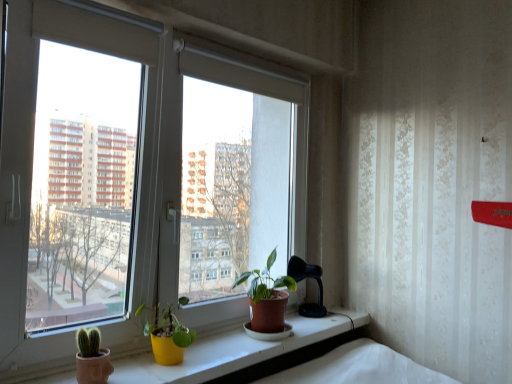
Question: From the image's perspective, is yellow matte pot at lower center, the second houseplant in the right-to-left sequence, positioned above or below matte yellow pot at center?

Choices:
 (A) above
 (B) below

Answer: (A)

Question: In terms of width, does yellow matte pot at lower center, the first houseplant in the front-to-back sequence, look wider or thinner when compared to matte yellow pot at center?

Choices:
 (A) wide
 (B) thin

Answer: (B)

Question: Based on their relative distances, which object is farther from the yellow matte pot at lower center, the 1th houseplant when ordered from left to right?

Choices:
 (A) matte yellow pot at center
 (B) matte brown pot at center, the second houseplant positioned from the front
 (C) white plastic window at center

Answer: (C)

Question: Considering the real-world distances, which object is closest to the matte yellow pot at center?

Choices:
 (A) yellow matte pot at lower center, the second houseplant in the right-to-left sequence
 (B) matte brown pot at center, positioned as the 2th houseplant in left-to-right order
 (C) white plastic window at center

Answer: (A)